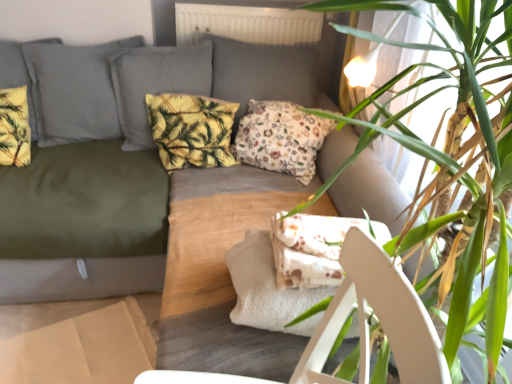
Question: Does floral fabric pillow at center, acting as the third pillow starting from the left, have a larger size compared to olive green fabric couch at upper left?

Choices:
 (A) no
 (B) yes

Answer: (A)

Question: Is floral fabric pillow at center, acting as the third pillow starting from the left, at the right side of olive green fabric couch at upper left?

Choices:
 (A) no
 (B) yes

Answer: (B)

Question: Is floral fabric pillow at center, the 1th pillow positioned from the right, surrounding olive green fabric couch at upper left?

Choices:
 (A) yes
 (B) no

Answer: (B)

Question: From the image's perspective, is floral fabric pillow at center, the 1th pillow positioned from the right, below olive green fabric couch at upper left?

Choices:
 (A) no
 (B) yes

Answer: (A)

Question: Is floral fabric pillow at center, acting as the third pillow starting from the left, far away from olive green fabric couch at upper left?

Choices:
 (A) no
 (B) yes

Answer: (A)

Question: Is floral fabric pillow at center, acting as the third pillow starting from the left, outside olive green fabric couch at upper left?

Choices:
 (A) yes
 (B) no

Answer: (B)

Question: From the image's perspective, is floral fabric pillow at center, acting as the third pillow starting from the left, over white cardboard box at lower left?

Choices:
 (A) yes
 (B) no

Answer: (A)

Question: Does floral fabric pillow at center, acting as the third pillow starting from the left, have a lesser height compared to white cardboard box at lower left?

Choices:
 (A) no
 (B) yes

Answer: (A)

Question: Is floral fabric pillow at center, the 1th pillow positioned from the right, smaller than white cardboard box at lower left?

Choices:
 (A) yes
 (B) no

Answer: (B)

Question: Does floral fabric pillow at center, the 1th pillow positioned from the right, appear on the left side of white cardboard box at lower left?

Choices:
 (A) no
 (B) yes

Answer: (A)

Question: Would you say white cardboard box at lower left is part of floral fabric pillow at center, the 1th pillow positioned from the right,'s contents?

Choices:
 (A) yes
 (B) no

Answer: (B)

Question: Is floral fabric pillow at center, the 1th pillow positioned from the right, wider than white cardboard box at lower left?

Choices:
 (A) yes
 (B) no

Answer: (B)

Question: Considering the relative sizes of floral fabric pillow at center, the 1th pillow positioned from the right, and green leafy plant at upper right in the image provided, is floral fabric pillow at center, the 1th pillow positioned from the right, wider than green leafy plant at upper right?

Choices:
 (A) yes
 (B) no

Answer: (B)